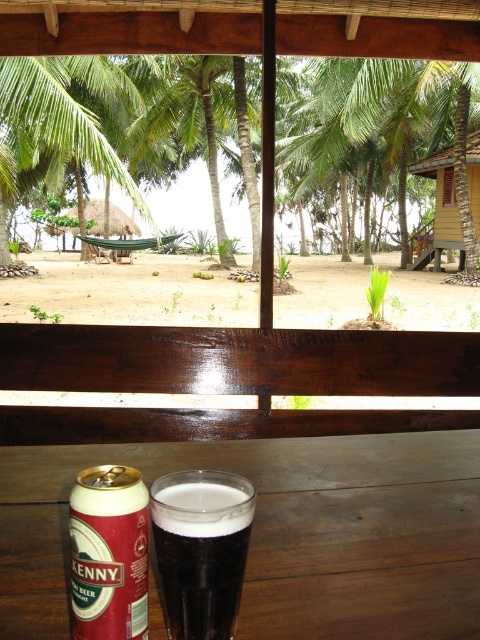
Is green leafy palm tree at center positioned in front of wooden window at center?

Yes, it is.

Is green leafy palm tree at center to the left of wooden window at center from the viewer's perspective?

Correct, you'll find green leafy palm tree at center to the left of wooden window at center.

Find the location of `green leafy palm tree at center`. green leafy palm tree at center is located at coordinates (201, 122).

Does point (78, 500) come closer to viewer compared to point (435, 260)?

Yes.

Is red matte can at lower left to the right of yellow wood hut at lower right from the viewer's perspective?

No, red matte can at lower left is not to the right of yellow wood hut at lower right.

Is point (84, 476) closer to viewer compared to point (440, 237)?

Yes, it is.

At what (x,y) coordinates should I click in order to perform the action: click on red matte can at lower left. Please return your answer as a coordinate pair (x, y). Looking at the image, I should click on (108, 554).

Which is more to the left, yellow wood hut at lower right or wooden window at center?

yellow wood hut at lower right is more to the left.

Between point (468, 177) and point (443, 202), which one is positioned in front?

Point (468, 177) is more forward.

I want to click on yellow wood hut at lower right, so click(435, 216).